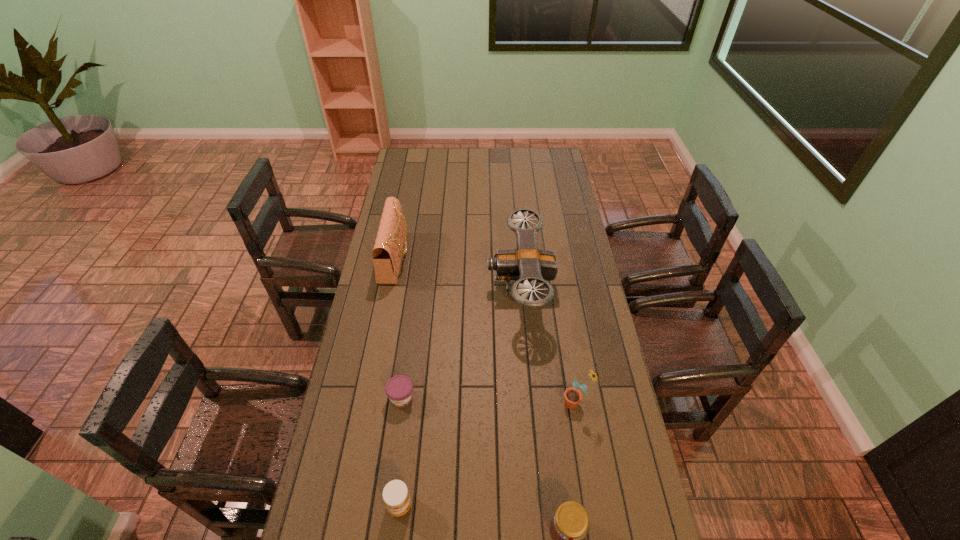
Find the location of a particular element. The height and width of the screenshot is (540, 960). drone is located at coordinates (527, 264).

This screenshot has width=960, height=540. Find the location of `the leftmost object`. the leftmost object is located at coordinates (388, 249).

Identify the location of sunflower. The width and height of the screenshot is (960, 540). (572, 396).

This screenshot has width=960, height=540. Find the location of `the farthest jam`. the farthest jam is located at coordinates (399, 389).

Locate an element on the screen. This screenshot has width=960, height=540. the shortest jam is located at coordinates (399, 389).

Identify the location of free region located on the front-facing side of the drone. This screenshot has width=960, height=540. (425, 286).

Identify the location of free space located 0.220m on the front-facing side of the drone. (433, 286).

Where is `vacant space situated on the front-facing side of the drone`? This screenshot has width=960, height=540. vacant space situated on the front-facing side of the drone is located at coordinates (408, 286).

Find the location of a particular element. vacant area situated 0.230m on the front-facing side of the handbag is located at coordinates (462, 257).

Identify the location of vacant region located 0.320m on the flower of the sunflower. This screenshot has width=960, height=540. (464, 403).